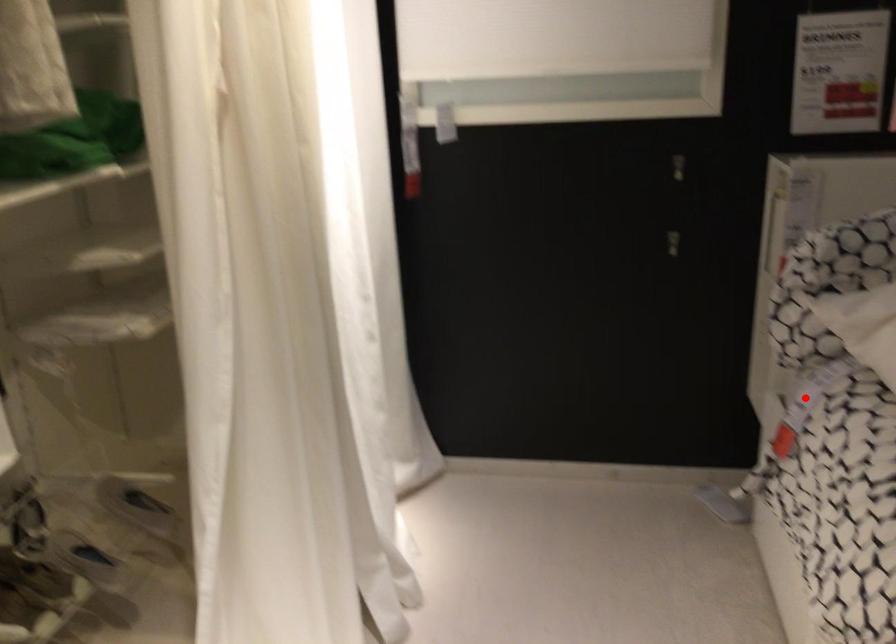
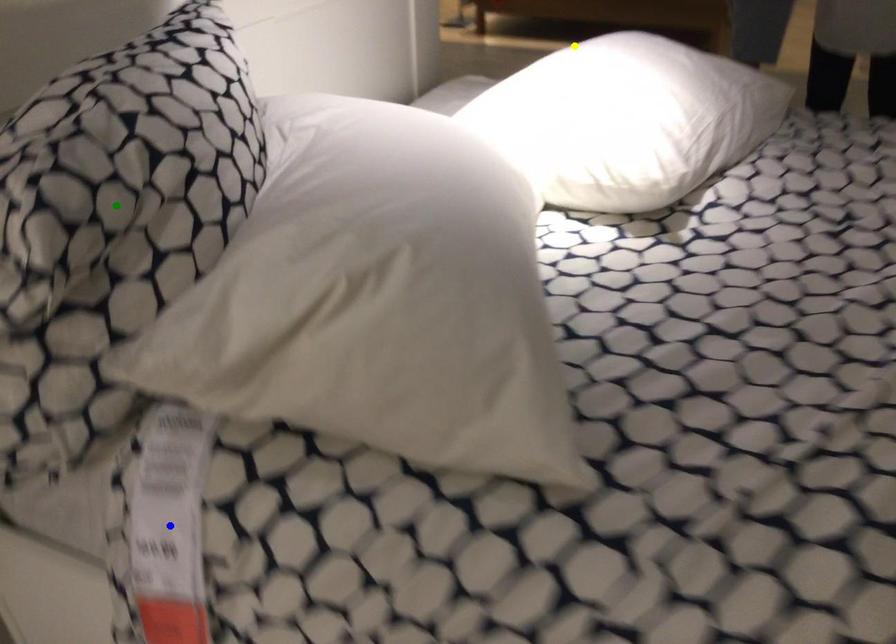
Question: I am providing you with two images of the same scene from different viewpoints. A red point is marked on the first image. You are given multiple points on the second image. Which point in image 2 is actually the same real-world point as the red point in image 1?

Choices:
 (A) green point
 (B) blue point
 (C) yellow point

Answer: (B)